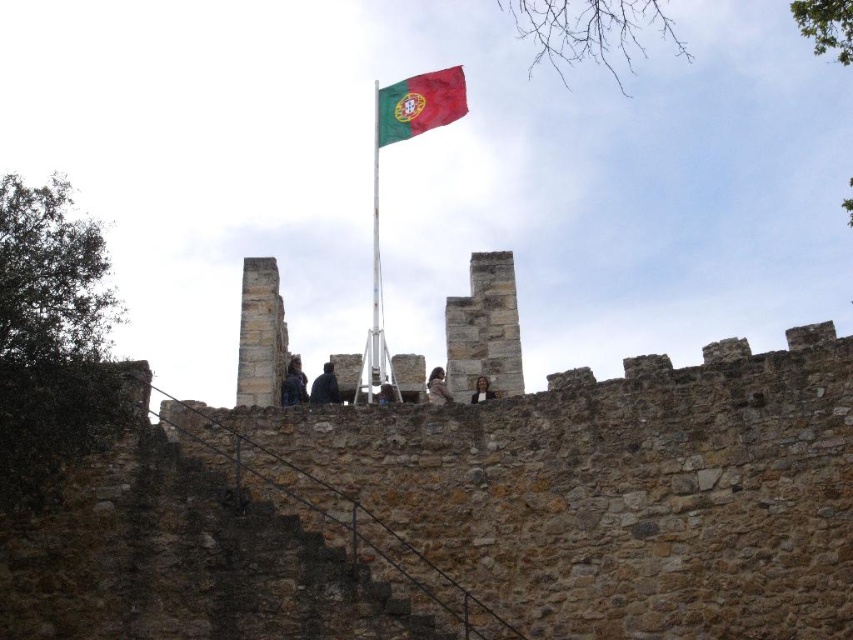
You are standing at the base of the historic stone wall and notice both the brown stone wall at upper center and the light brown leather jacket at center. Which object appears bigger in the scene?

The brown stone wall at upper center appears bigger than the light brown leather jacket at center because it has a larger size.

You are a tour guide explaining the historic castle wall to visitors. You notice two jackets hanging on the flagpole. Which jacket is closer to the flagpole, the dark blue denim jacket at upper center or the dark gray fabric jacket at center?

The dark blue denim jacket at upper center is closer to the flagpole because the dark gray fabric jacket at center is behind it.

You are a photographer trying to capture a portrait of a person standing between the dark gray fabric jacket at center and the smooth brown hair at center. Since you want to ensure the subject is fully visible, which object should you position closer to the camera to avoid blocking the view?

The dark gray fabric jacket at center is much taller than the smooth brown hair at center, so positioning the taller dark gray fabric jacket at center closer to the camera would block the view. To ensure the subject is fully visible, you should position the shorter smooth brown hair at center closer to the camera instead.